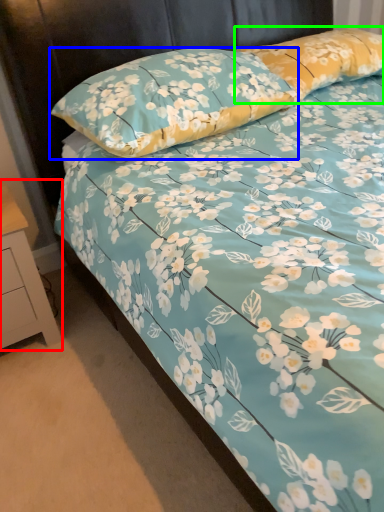
Question: Which object is the closest to the nightstand (highlighted by a red box)? Choose among these: pillow (highlighted by a blue box) or pillow (highlighted by a green box).

Choices:
 (A) pillow
 (B) pillow

Answer: (A)